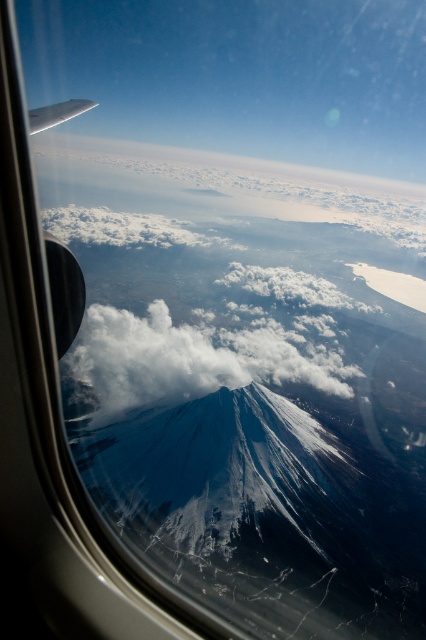
Can you confirm if white fluffy cloud at center is smaller than white matte wing at upper left?

No, white fluffy cloud at center is not smaller than white matte wing at upper left.

Between point (106, 364) and point (29, 112), which one is positioned behind?

Point (106, 364)

In order to click on white fluffy cloud at center in this screenshot , I will do `click(193, 358)`.